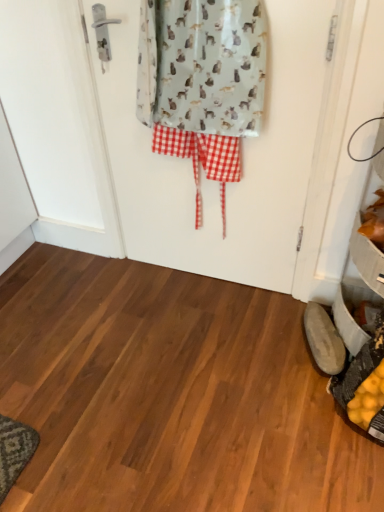
You are a GUI agent. You are given a task and a screenshot of the screen. Output one action in this format:
    pyautogui.click(x=<x>, y=<y>)
    Task: Click on the vacant area that is in front of brown leather shoe at lower right
    
    Given the screenshot: What is the action you would take?
    pyautogui.click(x=307, y=398)